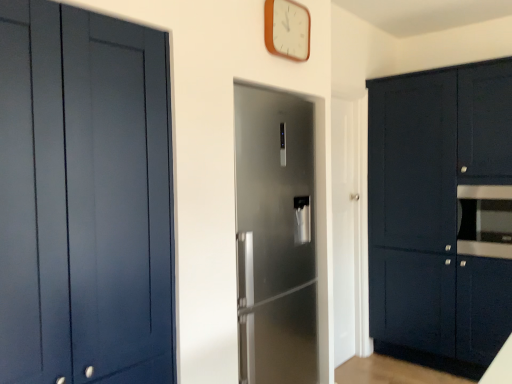
Measure the distance between white wooden clock at upper center and camera.

A distance of 6.63 feet exists between white wooden clock at upper center and camera.

Where is `white wooden clock at upper center`? The height and width of the screenshot is (384, 512). white wooden clock at upper center is located at coordinates (287, 29).

Describe the element at coordinates (276, 237) in the screenshot. This screenshot has width=512, height=384. I see `satin silver refrigerator at center, which is the 1th door in front-to-back order` at that location.

Image resolution: width=512 pixels, height=384 pixels. What do you see at coordinates (83, 198) in the screenshot?
I see `matte blue cabinet at left, the 2th cabinetry viewed from the right` at bounding box center [83, 198].

This screenshot has height=384, width=512. Describe the element at coordinates (485, 221) in the screenshot. I see `satin black oven at right` at that location.

Locate an element on the screen. white glossy door at center, marked as the 2th door in a left-to-right arrangement is located at coordinates (347, 222).

Which of these two, satin black oven at right or matte blue cabinet at left, the 2th cabinetry viewed from the right, stands taller?

matte blue cabinet at left, the 2th cabinetry viewed from the right.

Looking at this image, how much distance is there between satin black oven at right and matte blue cabinet at left, the 2th cabinetry viewed from the right?

They are 2.33 meters apart.

Is satin black oven at right not near matte blue cabinet at left, the first cabinetry in the left-to-right sequence?

Yes, satin black oven at right and matte blue cabinet at left, the first cabinetry in the left-to-right sequence, are quite far apart.

Is satin black oven at right wider than matte blue cabinet at left, which is the 2th cabinetry from back to front?

Correct, the width of satin black oven at right exceeds that of matte blue cabinet at left, which is the 2th cabinetry from back to front.

Is white wooden clock at upper center not close to satin silver refrigerator at center, the 2th door positioned from the back?

white wooden clock at upper center is near satin silver refrigerator at center, the 2th door positioned from the back, not far away.

Is white wooden clock at upper center in front of or behind satin silver refrigerator at center, the 2th door positioned from the back, in the image?

white wooden clock at upper center is positioned farther from the viewer than satin silver refrigerator at center, the 2th door positioned from the back.

Is white wooden clock at upper center inside or outside of satin silver refrigerator at center, the 1th door in the left-to-right sequence?

white wooden clock at upper center cannot be found inside satin silver refrigerator at center, the 1th door in the left-to-right sequence.

Which is more to the left, white wooden clock at upper center or satin silver refrigerator at center, the second door positioned from the right?

From the viewer's perspective, satin silver refrigerator at center, the second door positioned from the right, appears more on the left side.

Considering the positions of point (350, 211) and point (278, 28), is point (350, 211) closer or farther from the camera than point (278, 28)?

Point (350, 211) is farther from the camera than point (278, 28).

Is white glossy door at center, placed as the 2th door when sorted from front to back, aimed at white wooden clock at upper center?

No, white glossy door at center, placed as the 2th door when sorted from front to back, is not turned towards white wooden clock at upper center.

Does white glossy door at center, marked as the 2th door in a left-to-right arrangement, come behind white wooden clock at upper center?

Yes, white glossy door at center, marked as the 2th door in a left-to-right arrangement, is further from the viewer.

From a real-world perspective, between white glossy door at center, placed as the 2th door when sorted from front to back, and white wooden clock at upper center, who is vertically higher?

white wooden clock at upper center.

From a real-world perspective, between white wooden clock at upper center and matte dark blue cabinets at right, the second cabinetry positioned from the left, who is vertically lower?

From a 3D spatial view, matte dark blue cabinets at right, the second cabinetry positioned from the left, is below.

Can you confirm if white wooden clock at upper center is wider than matte dark blue cabinets at right, the first cabinetry in the right-to-left sequence?

No.

Is point (284, 56) farther from viewer compared to point (463, 158)?

No, (284, 56) is closer to viewer.

Looking at this image, can you confirm if white wooden clock at upper center is positioned to the left of matte dark blue cabinets at right, the first cabinetry in the right-to-left sequence?

Yes.

Is point (365, 203) positioned behind point (127, 171)?

Yes, point (365, 203) is behind point (127, 171).

Is white glossy door at center, marked as the 2th door in a left-to-right arrangement, next to matte blue cabinet at left, the 2th cabinetry viewed from the right, and touching it?

No, white glossy door at center, marked as the 2th door in a left-to-right arrangement, is not next to matte blue cabinet at left, the 2th cabinetry viewed from the right.

Would you say white glossy door at center, which is counted as the 1th door, starting from the right, is outside matte blue cabinet at left, which is the 2th cabinetry from back to front?

Yes, white glossy door at center, which is counted as the 1th door, starting from the right, is not within matte blue cabinet at left, which is the 2th cabinetry from back to front.

Can you tell me how much white wooden clock at upper center and satin black oven at right differ in facing direction?

There is a 86.5-degree angle between the facing directions of white wooden clock at upper center and satin black oven at right.

Which object is positioned more to the right, white wooden clock at upper center or satin black oven at right?

satin black oven at right.

Locate an element on the screen. This screenshot has width=512, height=384. clock that appears on the left of satin black oven at right is located at coordinates [287, 29].

Are white wooden clock at upper center and satin black oven at right located far from each other?

white wooden clock at upper center is positioned a significant distance from satin black oven at right.

Is matte dark blue cabinets at right, the second cabinetry positioned from the left, in front of white wooden clock at upper center?

No, the depth of matte dark blue cabinets at right, the second cabinetry positioned from the left, is greater than that of white wooden clock at upper center.

From a real-world perspective, which is physically below, matte dark blue cabinets at right, the second cabinetry positioned from the left, or white wooden clock at upper center?

matte dark blue cabinets at right, the second cabinetry positioned from the left.

From the image's perspective, count 2nd cabinetrys downward from the white wooden clock at upper center and point to it. Please provide its 2D coordinates.

[(441, 214)]

Considering the sizes of objects matte dark blue cabinets at right, the second cabinetry positioned from the left, and white wooden clock at upper center in the image provided, who is wider, matte dark blue cabinets at right, the second cabinetry positioned from the left, or white wooden clock at upper center?

matte dark blue cabinets at right, the second cabinetry positioned from the left.

This screenshot has height=384, width=512. What are the coordinates of `oven that appears on the right of matte blue cabinet at left, the 2th cabinetry viewed from the right` in the screenshot? It's located at (485, 221).

Image resolution: width=512 pixels, height=384 pixels. In order to click on clock behind the satin silver refrigerator at center, the 2th door positioned from the back in this screenshot , I will do `click(287, 29)`.

Looking at the image, which one is located further to white glossy door at center, which is counted as the 1th door, starting from the right, white wooden clock at upper center or matte dark blue cabinets at right, the second cabinetry positioned from the left?

Among the two, white wooden clock at upper center is located further to white glossy door at center, which is counted as the 1th door, starting from the right.

Consider the image. When comparing their distances from white glossy door at center, the 1th door positioned from the back, does satin silver refrigerator at center, the second door positioned from the right, or white wooden clock at upper center seem further?

Among the two, white wooden clock at upper center is located further to white glossy door at center, the 1th door positioned from the back.

Considering their positions, is satin silver refrigerator at center, the second door positioned from the right, positioned further to matte dark blue cabinets at right, the first cabinetry in the right-to-left sequence, than satin black oven at right?

satin silver refrigerator at center, the second door positioned from the right, is positioned further to the anchor matte dark blue cabinets at right, the first cabinetry in the right-to-left sequence.

When comparing their distances from white wooden clock at upper center, does satin silver refrigerator at center, the 2th door positioned from the back, or matte blue cabinet at left, which is the 2th cabinetry from back to front, seem closer?

satin silver refrigerator at center, the 2th door positioned from the back.

Looking at the image, which one is located further to matte blue cabinet at left, the 2th cabinetry viewed from the right, white glossy door at center, which is counted as the 1th door, starting from the right, or white wooden clock at upper center?

The object further to matte blue cabinet at left, the 2th cabinetry viewed from the right, is white glossy door at center, which is counted as the 1th door, starting from the right.

In the scene shown: Which object lies further to the anchor point matte blue cabinet at left, which appears as the 1th cabinetry when viewed from the front, matte dark blue cabinets at right, which ranks as the 1th cabinetry in back-to-front order, or white wooden clock at upper center?

The object further to matte blue cabinet at left, which appears as the 1th cabinetry when viewed from the front, is matte dark blue cabinets at right, which ranks as the 1th cabinetry in back-to-front order.

Which object lies nearer to the anchor point white wooden clock at upper center, matte dark blue cabinets at right, which ranks as the 2th cabinetry in front-to-back order, or matte blue cabinet at left, the 2th cabinetry viewed from the right?

matte blue cabinet at left, the 2th cabinetry viewed from the right, lies closer to white wooden clock at upper center than the other object.

Considering their positions, is white glossy door at center, marked as the 2th door in a left-to-right arrangement, positioned closer to matte dark blue cabinets at right, the second cabinetry positioned from the left, than satin black oven at right?

satin black oven at right is positioned closer to the anchor matte dark blue cabinets at right, the second cabinetry positioned from the left.

Where is `door between white wooden clock at upper center and matte dark blue cabinets at right, which ranks as the 2th cabinetry in front-to-back order, in the horizontal direction`? The image size is (512, 384). door between white wooden clock at upper center and matte dark blue cabinets at right, which ranks as the 2th cabinetry in front-to-back order, in the horizontal direction is located at coordinates (347, 222).

The height and width of the screenshot is (384, 512). I want to click on cabinetry between matte blue cabinet at left, the first cabinetry in the left-to-right sequence, and satin black oven at right, in the horizontal direction, so click(441, 214).

Identify the location of clock between satin silver refrigerator at center, the 1th door in the left-to-right sequence, and matte dark blue cabinets at right, which ranks as the 2th cabinetry in front-to-back order. The width and height of the screenshot is (512, 384). (287, 29).

This screenshot has height=384, width=512. Find the location of `door located between matte blue cabinet at left, which appears as the 1th cabinetry when viewed from the front, and white glossy door at center, the 1th door positioned from the back, in the depth direction`. door located between matte blue cabinet at left, which appears as the 1th cabinetry when viewed from the front, and white glossy door at center, the 1th door positioned from the back, in the depth direction is located at coordinates (276, 237).